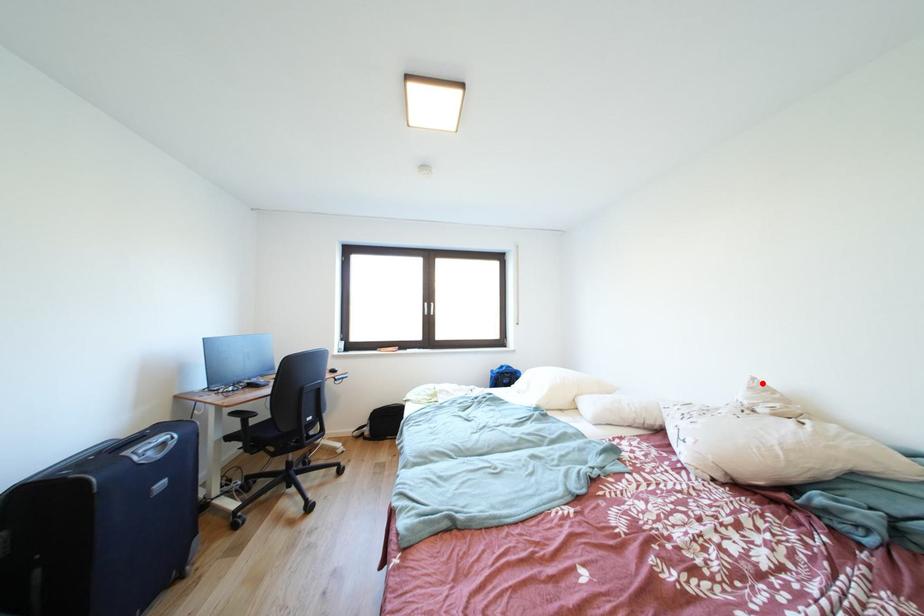
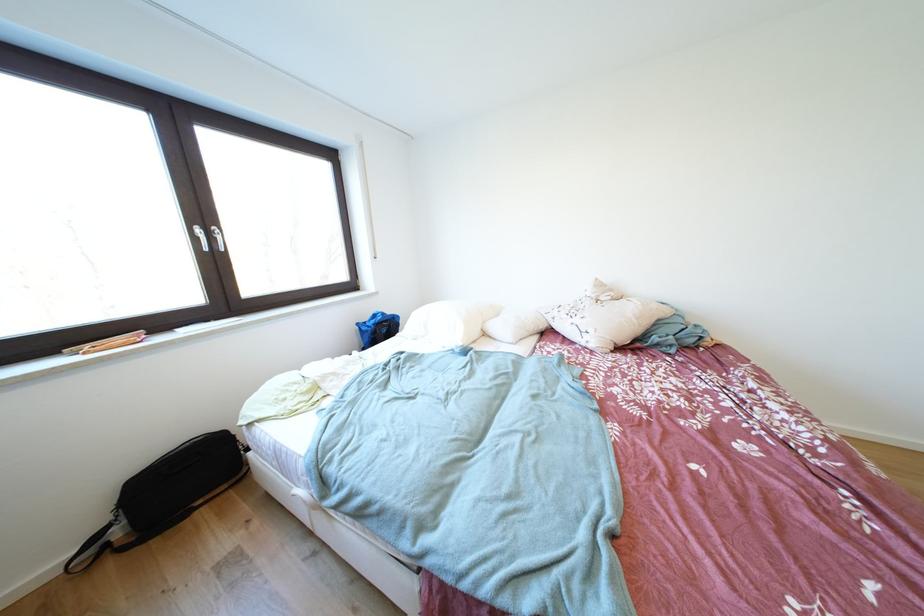
Locate, in the second image, the point that corresponds to the highlighted location in the first image.

(604, 284)